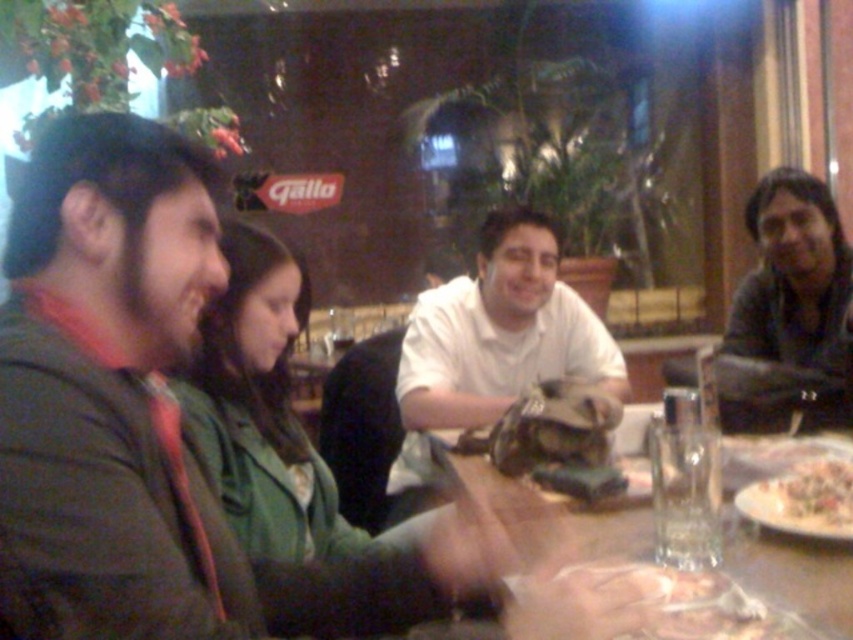
Question: Does dark brown leather jacket at left have a smaller size compared to white creamy pasta at lower right?

Choices:
 (A) no
 (B) yes

Answer: (A)

Question: Which point is farther to the camera?

Choices:
 (A) white matte shirt at center
 (B) white creamy pasta at lower right
 (C) dark gray sweater at upper right
 (D) translucent plastic bag at lower center

Answer: (C)

Question: Based on their relative distances, which object is nearer to the dark brown leather jacket at left?

Choices:
 (A) transparent glass at center
 (B) translucent plastic bag at lower center
 (C) white creamy pasta at lower right
 (D) dark gray sweater at upper right

Answer: (B)

Question: Can you confirm if dark gray sweater at upper right is positioned above white creamy pasta at lower right?

Choices:
 (A) no
 (B) yes

Answer: (B)

Question: Can you confirm if dark gray sweater at upper right is positioned above translucent plastic bag at lower center?

Choices:
 (A) no
 (B) yes

Answer: (B)

Question: Which point is closer to the camera?

Choices:
 (A) white creamy pasta at lower right
 (B) transparent glass at center

Answer: (B)